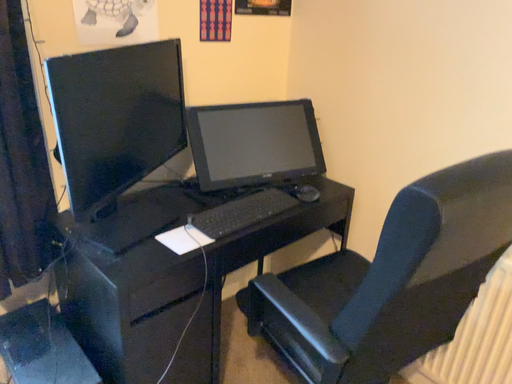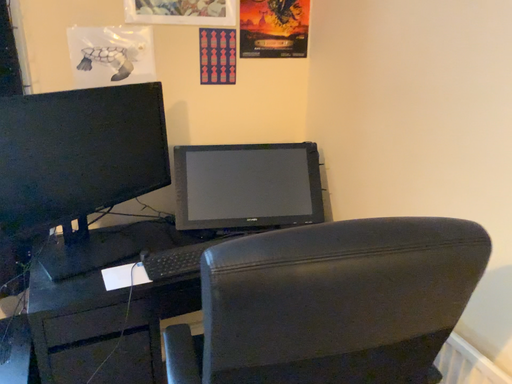
Question: Which way did the camera rotate in the video?

Choices:
 (A) rotated left
 (B) rotated right

Answer: (A)